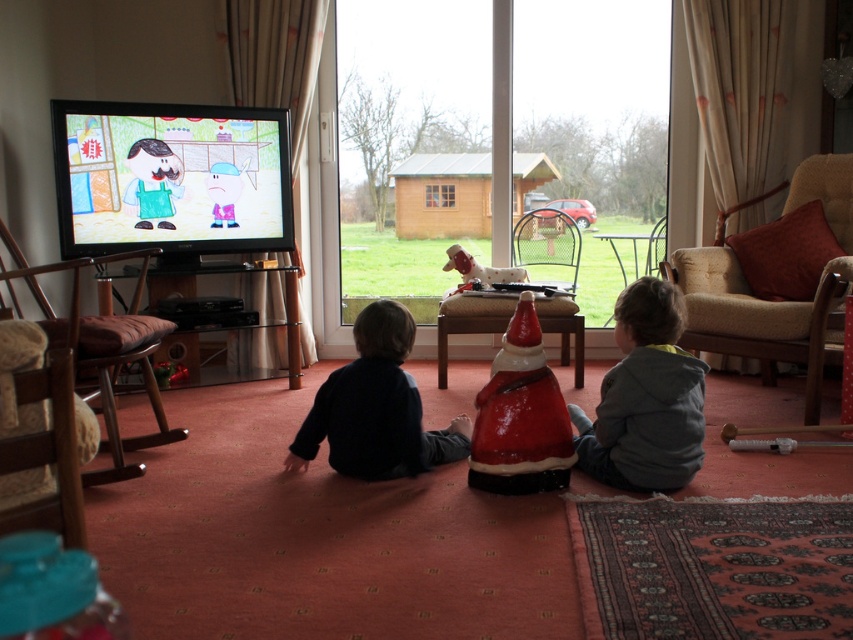
You are a parent looking for your children to put on their jackets before going outside. You see the gray fleece jacket at lower right and the dark blue sweater at center. Which jacket is positioned to the right of the other?

The gray fleece jacket at lower right is to the right of the dark blue sweater at center.

You are a child trying to reach the gray fleece jacket at lower right and the dark blue sweater at center. Which one can you grab first without moving your current position?

The gray fleece jacket at lower right is closer to the viewer than the dark blue sweater at center, so you can grab it first without moving.